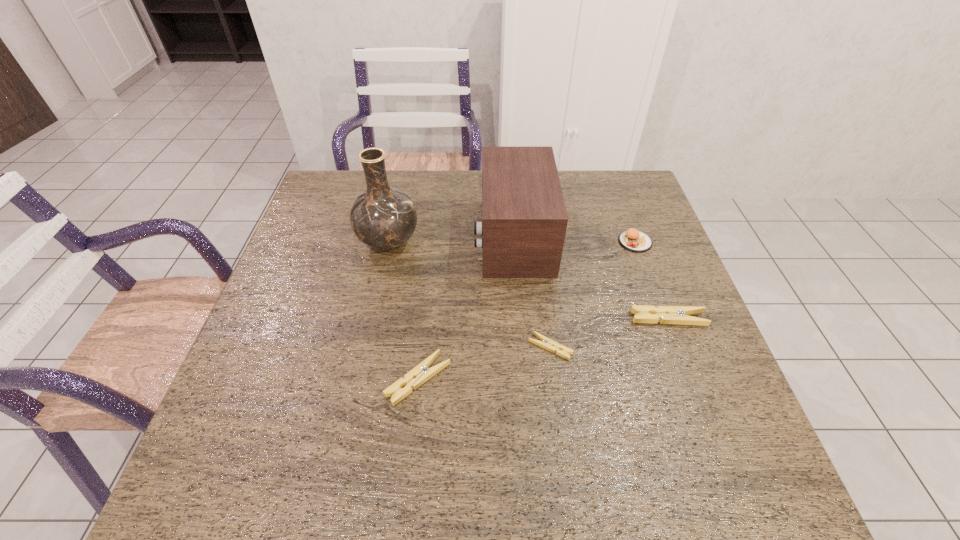
What are the coordinates of `vacant space that satisfies the following two spatial constraints: 1. on the front-facing side of the radio receiver; 2. on the front side of the tallest object` in the screenshot? It's located at (514, 242).

Where is `vacant space that satisfies the following two spatial constraints: 1. on the back side of the patty; 2. on the front-facing side of the fifth shortest object`? Image resolution: width=960 pixels, height=540 pixels. vacant space that satisfies the following two spatial constraints: 1. on the back side of the patty; 2. on the front-facing side of the fifth shortest object is located at coordinates (634, 237).

Identify the location of free space that satisfies the following two spatial constraints: 1. on the front-facing side of the patty; 2. on the left side of the second tallest object. (514, 242).